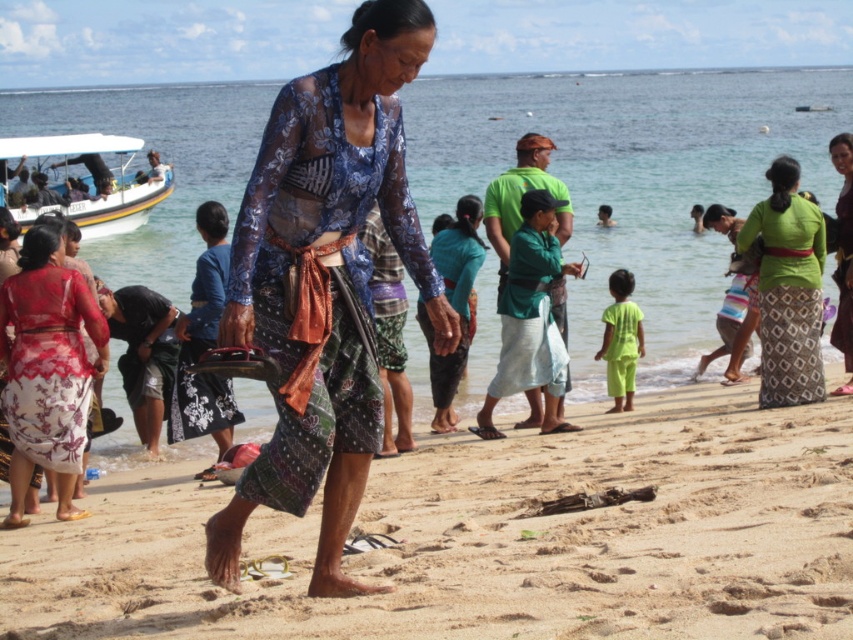
You are a photographer trying to capture a photo of the clear blue water at center and the translucent floral dress at lower left. Which object is closer to you?

The clear blue water at center is closer to you than the translucent floral dress at lower left because it is further to the viewer.

Based on the photo, you are a photographer standing on the beach and want to capture a photo of the green woven skirt at right and the neon green fabric at lower center. Which object should you focus on first if you want to include both in the frame without moving the camera?

You should focus on the neon green fabric at lower center first because it is closer to the camera than the green woven skirt at right, which is above it.

Based on the scene described, which object occupies a greater area in the image? Please consider the clear blue water at center and the batik fabric dress at center in your answer.

The clear blue water at center has a larger size compared to the batik fabric dress at center, so the clear blue water at center occupies a greater area in the image.